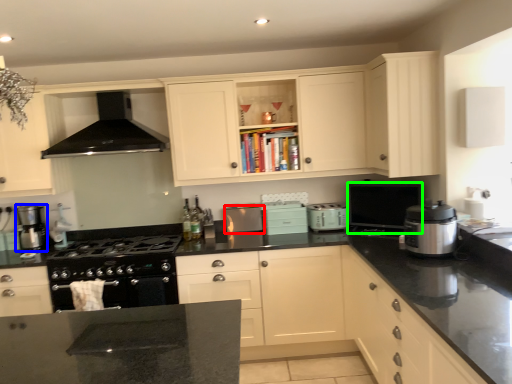
Question: Based on their relative distances, which object is farther from kitchen appliance (highlighted by a red box)? Choose from kitchen appliance (highlighted by a blue box) and appliance (highlighted by a green box).

Choices:
 (A) kitchen appliance
 (B) appliance

Answer: (A)